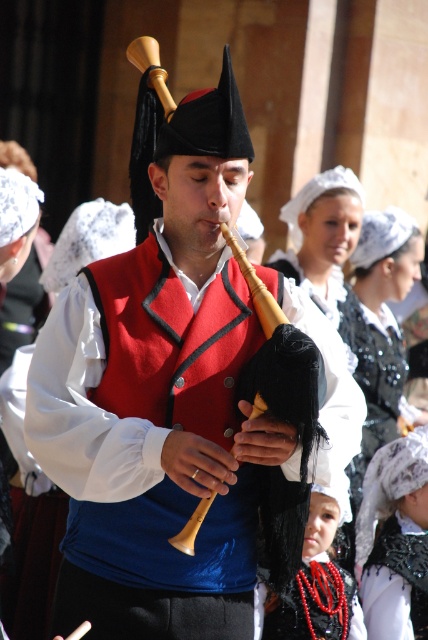
Question: Is black sequined dress at center positioned at the back of wooden bagpipe at center?

Choices:
 (A) yes
 (B) no

Answer: (A)

Question: Can you confirm if black sequined dress at center is wider than wooden bagpipe at center?

Choices:
 (A) no
 (B) yes

Answer: (A)

Question: Which of these objects is positioned farthest from the black sequined dress at center?

Choices:
 (A) wooden bagpipe at center
 (B) black beaded necklace at center

Answer: (A)

Question: Which point is closer to the camera?

Choices:
 (A) matte red vest at center
 (B) black beaded necklace at center
 (C) black sequined dress at center

Answer: (A)

Question: Can you confirm if black sequined dress at center is positioned to the right of black beaded necklace at center?

Choices:
 (A) no
 (B) yes

Answer: (B)

Question: Among these points, which one is nearest to the camera?

Choices:
 (A) (82, 598)
 (B) (368, 620)
 (C) (196, 532)

Answer: (C)